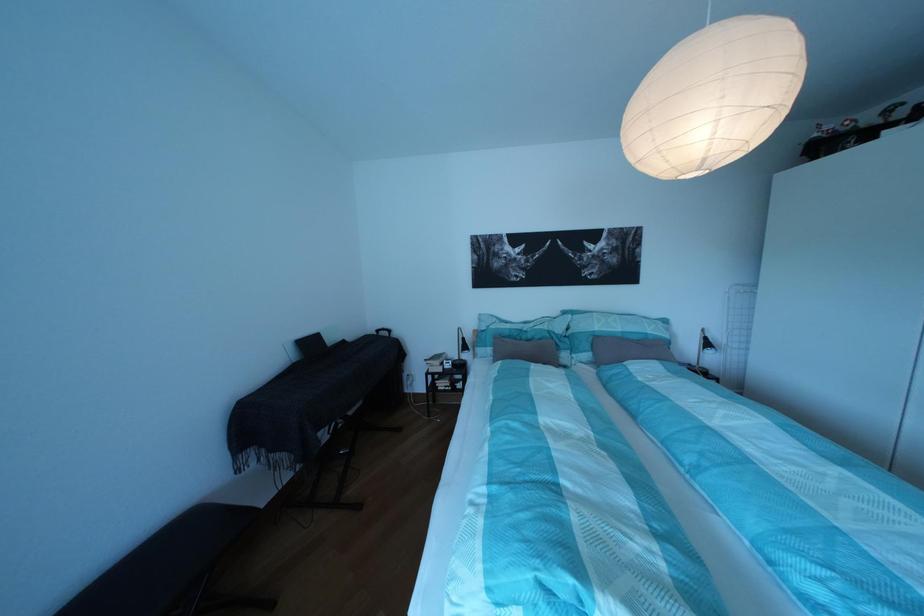
In order to click on black lamp head in this screenshot , I will do `click(704, 342)`.